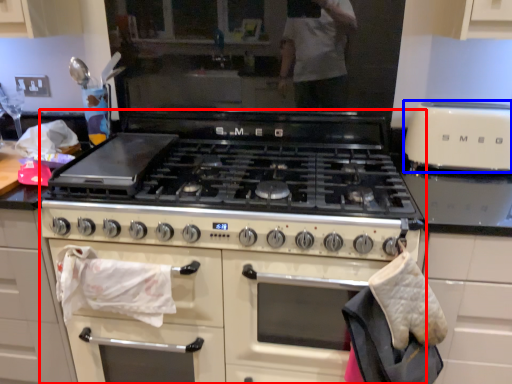
Question: Which of the following is the closest to the observer, appliance (highlighted by a red box) or kitchen appliance (highlighted by a blue box)?

Choices:
 (A) appliance
 (B) kitchen appliance

Answer: (A)